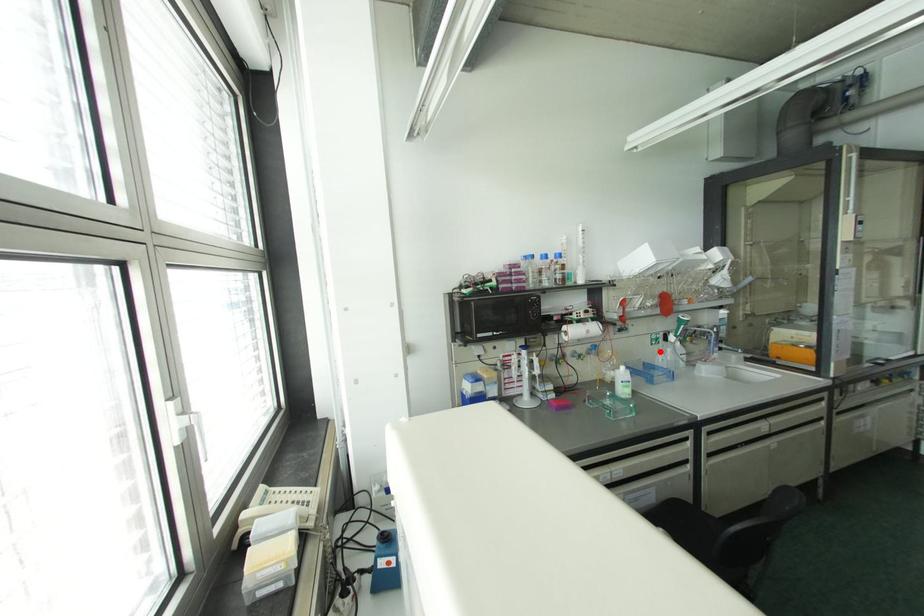
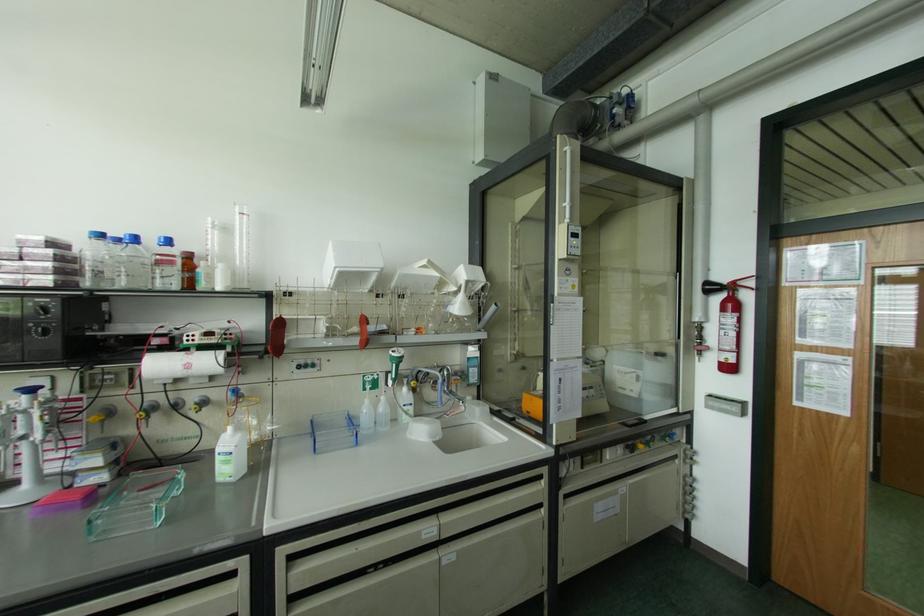
The point at the highlighted location is marked in the first image. Where is the corresponding point in the second image?

(367, 400)